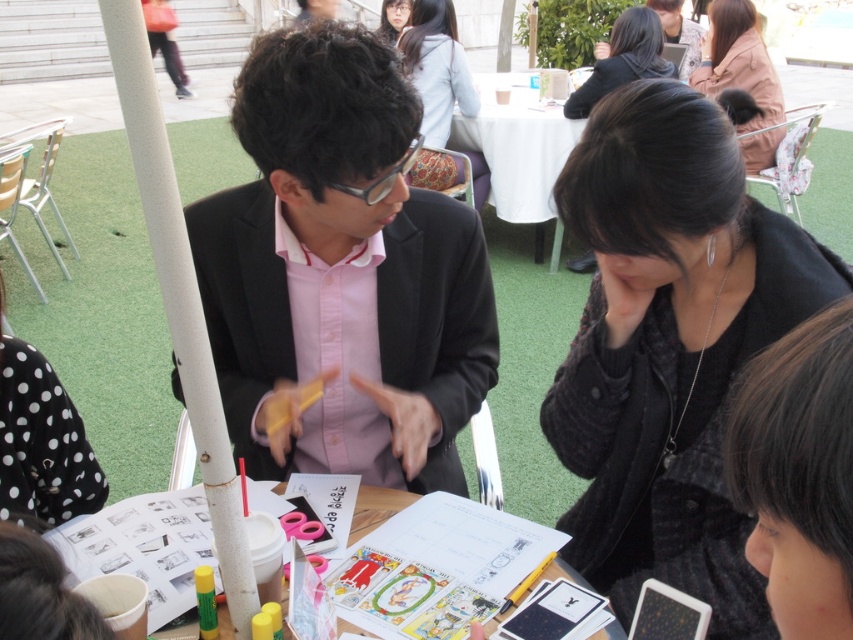
Question: Which of the following is the farthest from the observer?

Choices:
 (A) (25, 440)
 (B) (393, 12)
 (C) (657, 44)

Answer: (B)

Question: Where is light blue fabric jacket at upper center located in relation to white paper at center in the image?

Choices:
 (A) above
 (B) below

Answer: (A)

Question: Does white tablecloth at upper center have a smaller size compared to white paper at center?

Choices:
 (A) no
 (B) yes

Answer: (A)

Question: Can you confirm if matte black suit at center is wider than dark brown hair at lower right?

Choices:
 (A) no
 (B) yes

Answer: (B)

Question: Among these objects, which one is nearest to the camera?

Choices:
 (A) black textured sweater at center
 (B) black matte hair at upper center
 (C) dark brown hair at lower right
 (D) black dotted fabric at lower left

Answer: (C)

Question: Among these objects, which one is farthest from the camera?

Choices:
 (A) dark brown hair at lower right
 (B) matte black hair at upper center
 (C) black matte hair at upper center
 (D) light blue fabric jacket at upper center

Answer: (B)